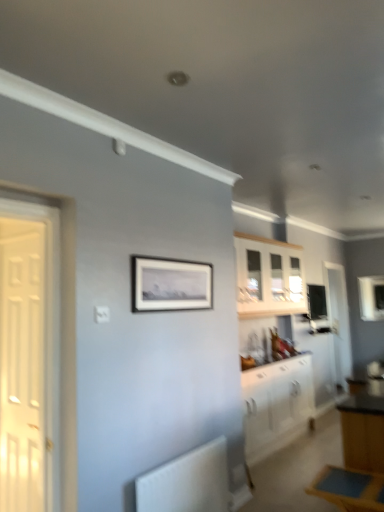
The height and width of the screenshot is (512, 384). Describe the element at coordinates (349, 489) in the screenshot. I see `blue wooden table at lower right` at that location.

This screenshot has height=512, width=384. What are the coordinates of `white wooden door at left, arranged as the first door when viewed from the front` in the screenshot? It's located at (23, 364).

Locate an element on the screen. blue wooden table at lower right is located at coordinates (349, 489).

Can you confirm if clear glass window at upper right is positioned to the left of blue wooden table at lower right?

Incorrect, clear glass window at upper right is not on the left side of blue wooden table at lower right.

Would you say clear glass window at upper right is a long distance from blue wooden table at lower right?

clear glass window at upper right is far away from blue wooden table at lower right.

Measure the distance from clear glass window at upper right to blue wooden table at lower right.

clear glass window at upper right is 4.45 meters away from blue wooden table at lower right.

Is clear glass window at upper right looking in the opposite direction of blue wooden table at lower right?

No, clear glass window at upper right is not facing away from blue wooden table at lower right.

Consider the image. Which point is more forward, (196,480) or (144,284)?

Positioned in front is point (144,284).

Does white matte radiator at lower left come behind matte black picture frame at center?

No, white matte radiator at lower left is in front of matte black picture frame at center.

From a real-world perspective, which is physically above, white matte radiator at lower left or matte black picture frame at center?

matte black picture frame at center.

Measure the distance between white matte radiator at lower left and matte black picture frame at center.

white matte radiator at lower left is 1.07 meters away from matte black picture frame at center.

Is clear glass window at upper right far away from white glossy cabinet at lower right, placed as the second cabinetry when sorted from top to bottom?

clear glass window at upper right is positioned a significant distance from white glossy cabinet at lower right, placed as the second cabinetry when sorted from top to bottom.

Which of these two, clear glass window at upper right or white glossy cabinet at lower right, the 1th cabinetry from the bottom, is wider?

white glossy cabinet at lower right, the 1th cabinetry from the bottom.

Is point (381, 280) more distant than point (279, 423)?

Yes, it is behind point (279, 423).

Looking at this image, who is smaller, clear glass window at upper right or white glossy cabinet at lower right, placed as the second cabinetry when sorted from top to bottom?

With smaller size is clear glass window at upper right.

From a real-world perspective, which is physically below, white glossy door at right, which is the first door in back-to-front order, or matte black picture frame at center?

white glossy door at right, which is the first door in back-to-front order, is physically lower.

Is white glossy door at right, which appears as the second door when viewed from the front, closer to camera compared to matte black picture frame at center?

No, white glossy door at right, which appears as the second door when viewed from the front, is behind matte black picture frame at center.

In the image, is white glossy door at right, which is the 1th door from right to left, on the left side or the right side of matte black picture frame at center?

white glossy door at right, which is the 1th door from right to left, is positioned on matte black picture frame at center's right side.

Who is taller, white glossy door at right, which is the 1th door from right to left, or matte black picture frame at center?

white glossy door at right, which is the 1th door from right to left, is taller.

Considering the sizes of objects white glossy cabinet at lower right, placed as the second cabinetry when sorted from top to bottom, and blue wooden table at lower right in the image provided, who is smaller, white glossy cabinet at lower right, placed as the second cabinetry when sorted from top to bottom, or blue wooden table at lower right?

With smaller size is blue wooden table at lower right.

From the picture: From the image's perspective, which object appears higher, white glossy cabinet at lower right, the 1th cabinetry from the bottom, or blue wooden table at lower right?

blue wooden table at lower right appears higher in the image.

Which object is positioned more to the left, white glossy cabinet at lower right, the 1th cabinetry from the bottom, or blue wooden table at lower right?

blue wooden table at lower right is more to the left.

Which object is more forward, white glossy cabinet at lower right, placed as the second cabinetry when sorted from top to bottom, or blue wooden table at lower right?

Positioned in front is blue wooden table at lower right.

Is white wood cabinet at upper center, the second cabinetry when ordered from bottom to top, outside of white glossy door at right, the second door viewed from the left?

Yes, white wood cabinet at upper center, the second cabinetry when ordered from bottom to top, is not within white glossy door at right, the second door viewed from the left.

Can you confirm if white wood cabinet at upper center, the second cabinetry when ordered from bottom to top, is bigger than white glossy door at right, which appears as the second door when viewed from the front?

Actually, white wood cabinet at upper center, the second cabinetry when ordered from bottom to top, might be smaller than white glossy door at right, which appears as the second door when viewed from the front.

Between white wood cabinet at upper center, the second cabinetry when ordered from bottom to top, and white glossy door at right, which appears as the second door when viewed from the front, which one is positioned in front?

Positioned in front is white wood cabinet at upper center, the second cabinetry when ordered from bottom to top.

Is point (342, 471) positioned after point (240, 266)?

No, (342, 471) is closer to viewer.

Could you tell me if blue wooden table at lower right is turned towards white wood cabinet at upper center, the second cabinetry when ordered from bottom to top?

No, blue wooden table at lower right is not oriented towards white wood cabinet at upper center, the second cabinetry when ordered from bottom to top.

Can you confirm if blue wooden table at lower right is positioned to the right of white wood cabinet at upper center, which appears as the 1th cabinetry when viewed from the top?

No.

Who is shorter, blue wooden table at lower right or white wood cabinet at upper center, which appears as the 1th cabinetry when viewed from the top?

blue wooden table at lower right.

Identify the location of window behind the blue wooden table at lower right. Image resolution: width=384 pixels, height=512 pixels. (371, 298).

Where is `picture frame above the white matte radiator at lower left (from the image's perspective)`? This screenshot has height=512, width=384. picture frame above the white matte radiator at lower left (from the image's perspective) is located at coordinates (170, 285).

Looking at the image, which one is located further to white wooden door at left, which is the second door from right to left, clear glass window at upper right or blue wooden table at lower right?

Based on the image, clear glass window at upper right appears to be further to white wooden door at left, which is the second door from right to left.

Considering their positions, is white wood cabinet at upper center, the second cabinetry when ordered from bottom to top, positioned further to clear glass window at upper right than white matte radiator at lower left?

Among the two, white matte radiator at lower left is located further to clear glass window at upper right.

Based on the photo, which object lies nearer to the anchor point white wooden door at left, the first door positioned from the left, white glossy cabinet at lower right, the 1th cabinetry from the bottom, or matte black picture frame at center?

matte black picture frame at center.

Looking at this image, which object lies further to the anchor point clear glass window at upper right, white matte radiator at lower left or white glossy door at right, which appears as the second door when viewed from the front?

The object further to clear glass window at upper right is white matte radiator at lower left.

When comparing their distances from clear glass window at upper right, does white wood cabinet at upper center, the second cabinetry when ordered from bottom to top, or white glossy cabinet at lower right, the 1th cabinetry from the bottom, seem further?

white glossy cabinet at lower right, the 1th cabinetry from the bottom.

Based on their spatial positions, is clear glass window at upper right or matte black picture frame at center further from white wood cabinet at upper center, which appears as the 1th cabinetry when viewed from the top?

Based on the image, clear glass window at upper right appears to be further to white wood cabinet at upper center, which appears as the 1th cabinetry when viewed from the top.

Considering their positions, is blue wooden table at lower right positioned closer to white wood cabinet at upper center, which appears as the 1th cabinetry when viewed from the top, than white glossy cabinet at lower right, the 1th cabinetry from the bottom?

white glossy cabinet at lower right, the 1th cabinetry from the bottom, lies closer to white wood cabinet at upper center, which appears as the 1th cabinetry when viewed from the top, than the other object.

When comparing their distances from white glossy cabinet at lower right, placed as the second cabinetry when sorted from top to bottom, does clear glass window at upper right or blue wooden table at lower right seem closer?

Based on the image, blue wooden table at lower right appears to be nearer to white glossy cabinet at lower right, placed as the second cabinetry when sorted from top to bottom.

This screenshot has width=384, height=512. I want to click on picture frame between blue wooden table at lower right and clear glass window at upper right along the z-axis, so click(x=170, y=285).

You are a GUI agent. You are given a task and a screenshot of the screen. Output one action in this format:
    pyautogui.click(x=<x>, y=<y>)
    Task: Click on the picture frame located between blue wooden table at lower right and white glossy door at right, the second door viewed from the left, in the depth direction
    This screenshot has width=384, height=512.
    Given the screenshot: What is the action you would take?
    pyautogui.click(x=170, y=285)

Identify the location of picture frame between white wooden door at left, arranged as the first door when viewed from the front, and blue wooden table at lower right. (170, 285).

At what (x,y) coordinates should I click in order to perform the action: click on door between blue wooden table at lower right and white glossy door at right, which appears as the second door when viewed from the front, from front to back. Please return your answer as a coordinate pair (x, y). Looking at the image, I should click on (23, 364).